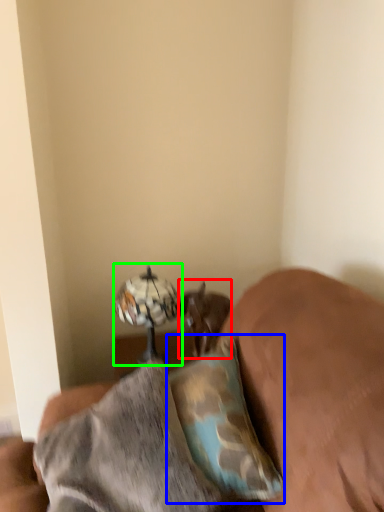
Question: Which object is positioned farthest from animal (highlighted by a red box)? Select from pillow (highlighted by a blue box) and table lamp (highlighted by a green box).

Choices:
 (A) pillow
 (B) table lamp

Answer: (A)